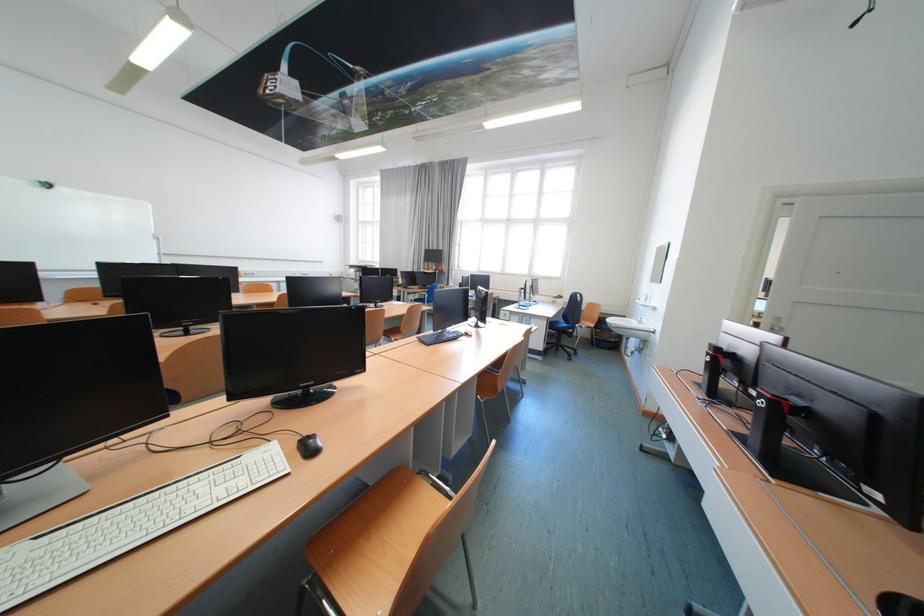
Find the location of a particular element. black computer mouse is located at coordinates (309, 446).